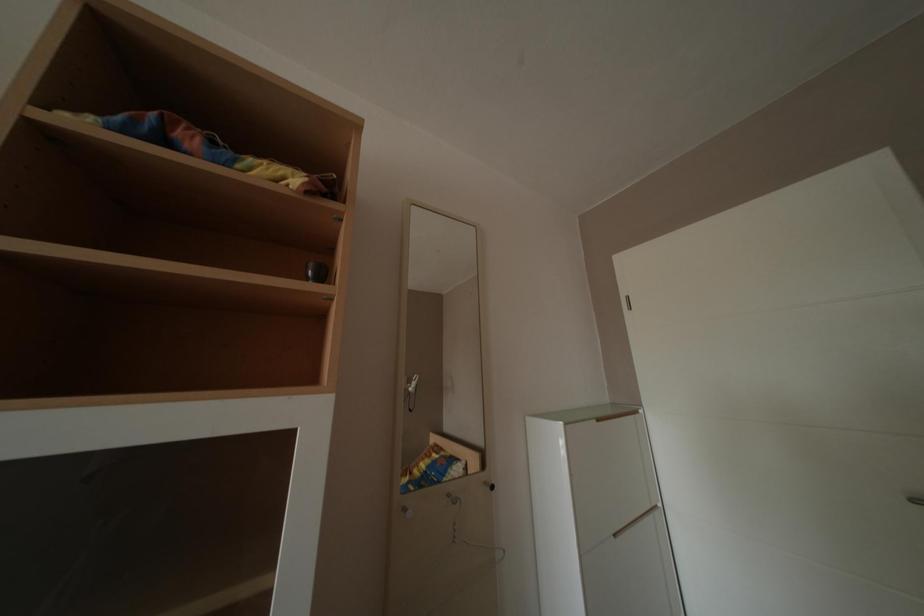
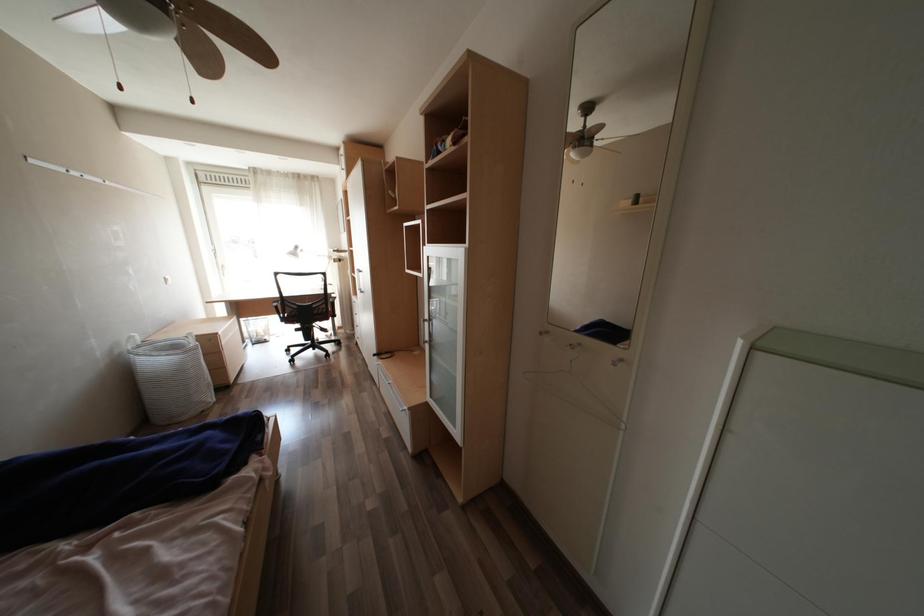
Question: The camera is either moving clockwise (left) or counter-clockwise (right) around the object. The first image is from the beginning of the video and the second image is from the end. Is the camera moving left or right when shooting the video?

Choices:
 (A) Left
 (B) Right

Answer: (B)